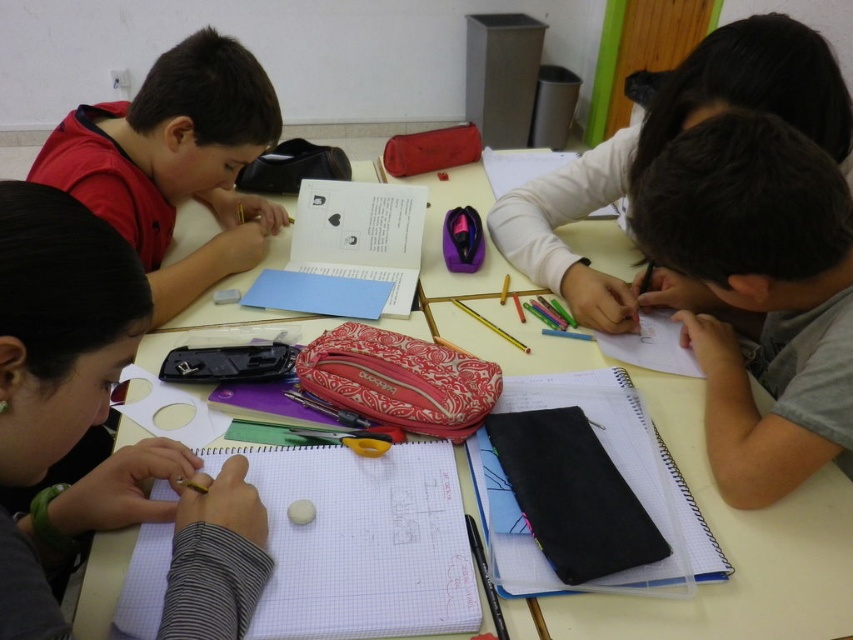
You are a teacher observing the classroom scene. You need to locate the white paper at lower left. Based on the coordinates provided, where exactly would you find it in the image?

The white paper at lower left is located at the coordinates point (735, 552) in the image.

Consider the image. You are a teacher observing the classroom scene. You need to place a ruler between the white paper at lower left and the gray matte notebook at lower right. Can the ruler of 10 inches fit between them without bending?

The distance between the white paper at lower left and the gray matte notebook at lower right is 9.42 inches. Since the ruler is 10 inches long, it will extend beyond the space between them by approximately 0.58 inches. Therefore, the ruler cannot fit entirely between them without bending.

You are standing at the center of the classroom looking towards the table. Which of the two points, point (167, 477) or point (583, 522), is closer to you?

Point (583, 522) is closer to you because it is in front of point (167, 477).